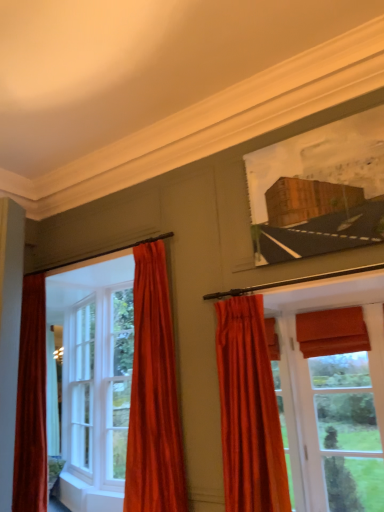
Question: Which is correct: velvet orange curtain at center, the first curtain positioned from the right, is inside white wood window at left, which appears as the second window when viewed from the right, or outside of it?

Choices:
 (A) outside
 (B) inside

Answer: (A)

Question: From a real-world perspective, is velvet orange curtain at center, the first curtain positioned from the right, above or below white wood window at left, acting as the first window starting from the back?

Choices:
 (A) above
 (B) below

Answer: (B)

Question: Which of these objects is positioned farthest from the wooden frame at upper right?

Choices:
 (A) velvet orange curtain at center, acting as the second curtain starting from the left
 (B) matte orange roman shade at right, which ranks as the first window in right-to-left order
 (C) white wood window at left, acting as the first window starting from the back
 (D) velvet orange curtain at left, the 2th curtain when ordered from right to left

Answer: (C)

Question: Which of these objects is positioned farthest from the velvet orange curtain at center, acting as the second curtain starting from the left?

Choices:
 (A) white wood window at left, the first window when ordered from left to right
 (B) matte orange roman shade at right, which appears as the 2th window when viewed from the back
 (C) wooden frame at upper right
 (D) velvet orange curtain at left, the 2th curtain when ordered from right to left

Answer: (A)